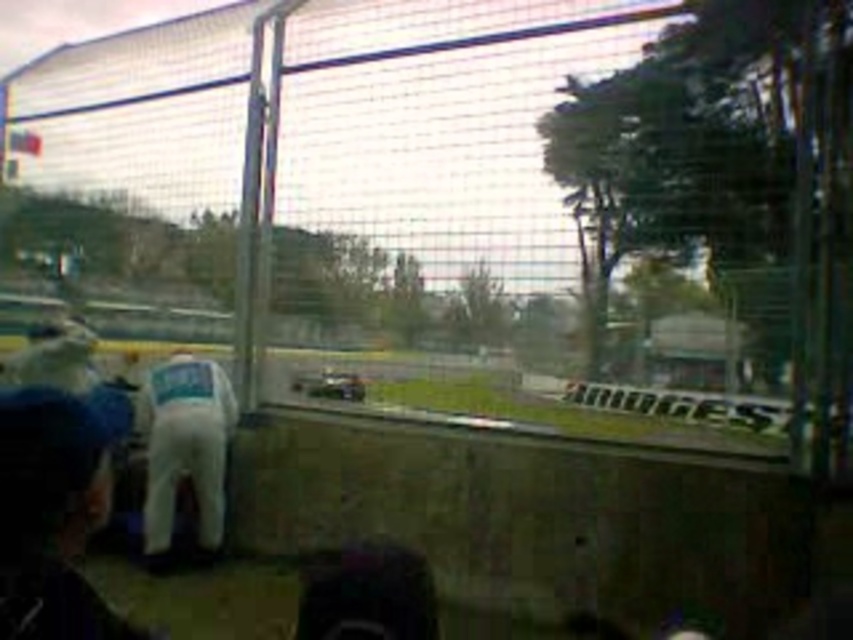
You are a photographer at the pit lane and want to take a photo of the white fabric man at lower left and the metallic mesh fence at center. Based on their positions, which object should be placed on the left side of the photo frame?

The white fabric man at lower left should be placed on the left side of the photo frame because the metallic mesh fence at center is positioned on the right side of it.